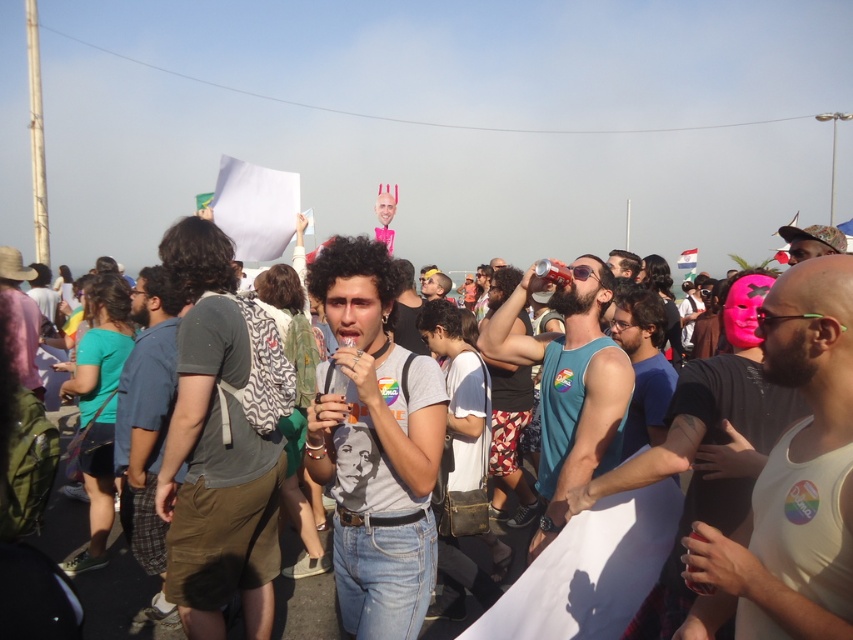
You are standing at the point marked by the coordinates point (x=215, y=451) in the image. What is the closest clothing item to your current position?

The point (x=215, y=451) marks the dark gray cotton t shirt at center, so the closest clothing item to your current position is the dark gray cotton t shirt at center.